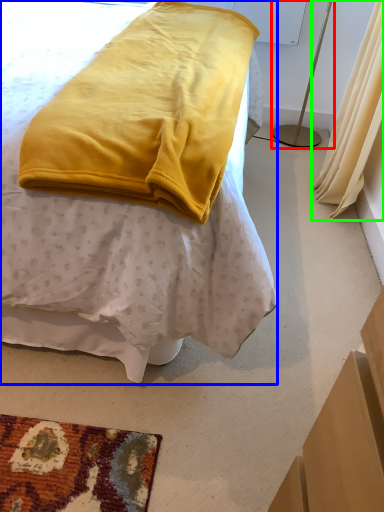
Question: Which object is positioned closest to bedside lamp (highlighted by a red box)? Select from bed (highlighted by a blue box) and curtain (highlighted by a green box).

Choices:
 (A) bed
 (B) curtain

Answer: (B)